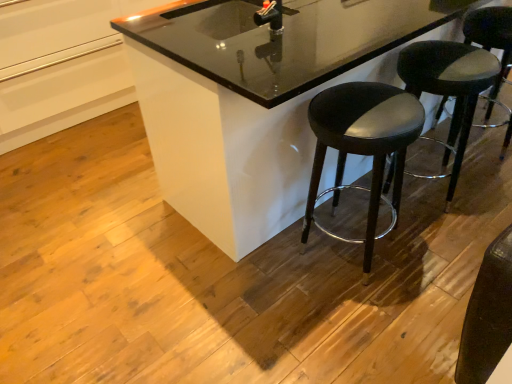
The height and width of the screenshot is (384, 512). Find the location of `vacant space in black leather stool at center, which is the 3th stool in right-to-left order (from a real-world perspective)`. vacant space in black leather stool at center, which is the 3th stool in right-to-left order (from a real-world perspective) is located at coordinates [x=356, y=264].